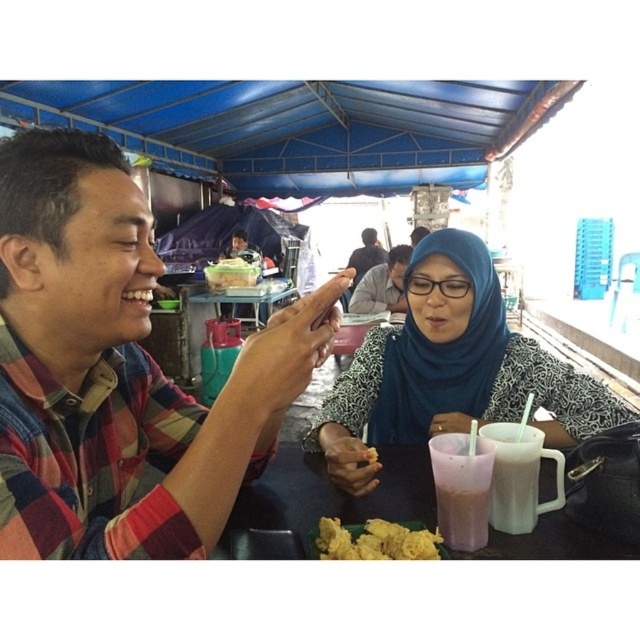
You are a waiter at this outdoor dining area. You need to deliver a dessert to the customer wearing the matte black shirt at center. Where should you place the dessert relative to the matte white mug at lower right?

The matte white mug at lower right is to the right of the matte black shirt at center. Therefore, you should place the dessert to the left of the matte white mug at lower right so that it is near the matte black shirt at center.

You are a photographer trying to capture the blue printed dress at center in the image. What coordinates should you aim for to ensure the dress is centered in your shot?

The blue printed dress at center is located at coordinates point (x=449, y=371), so aim for that point to center it in your shot.

You are a photographer taking a photo of the blue printed dress at center and the matte black shirt at center. Which one should you focus on first if you want to capture both clearly in the same frame?

The blue printed dress at center is below matte black shirt at center, so you should focus on the matte black shirt at center first to ensure both are in focus since it is closer to the camera.